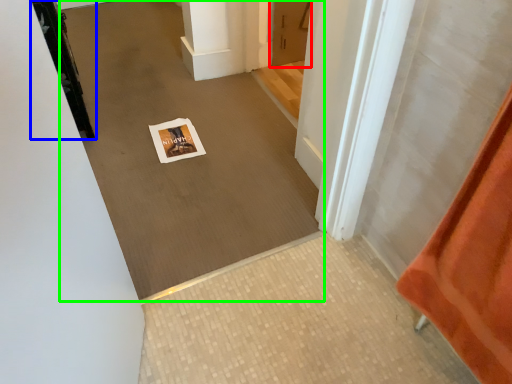
Question: Which object is positioned farthest from door (highlighted by a red box)? Select from door (highlighted by a blue box) and plain (highlighted by a green box).

Choices:
 (A) door
 (B) plain

Answer: (A)